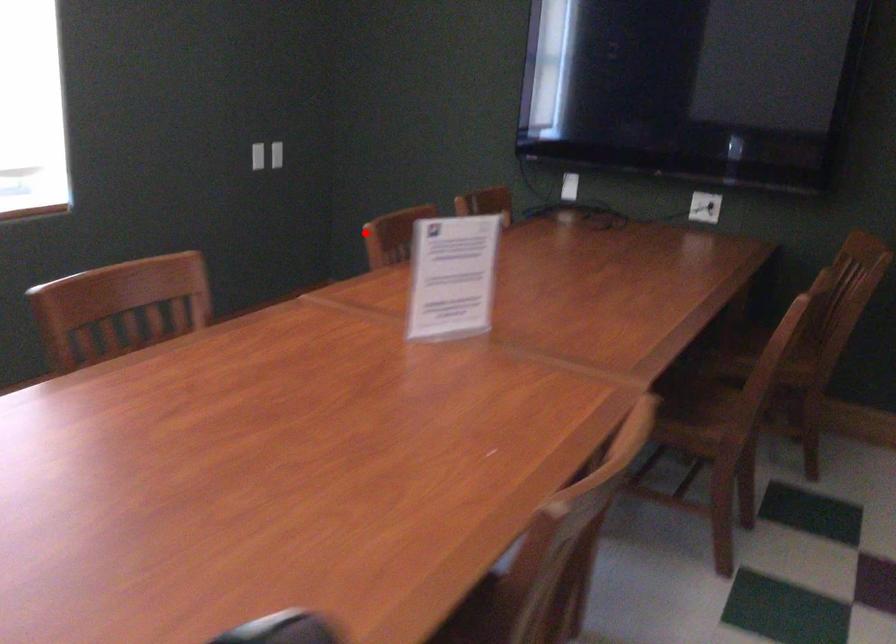
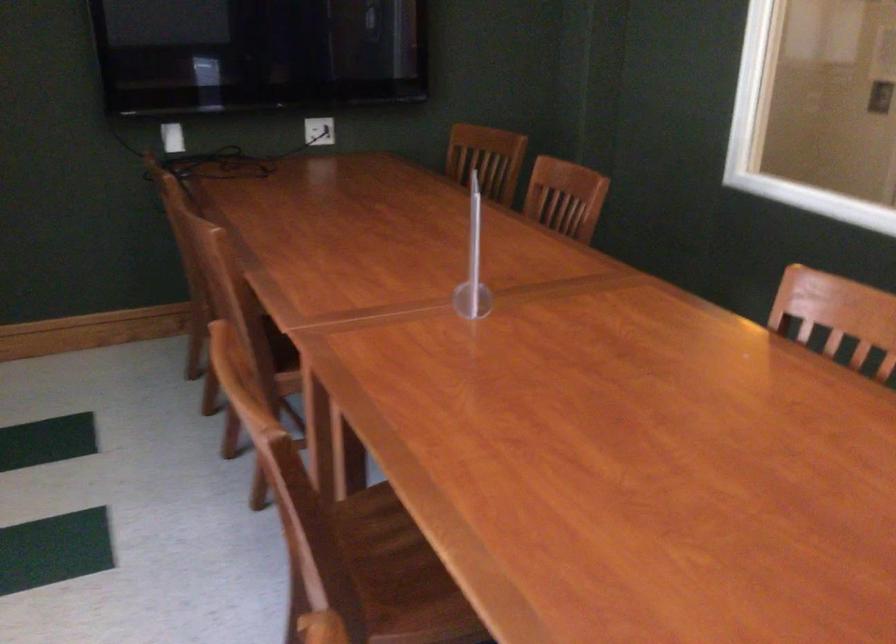
The point at the highlighted location is marked in the first image. Where is the corresponding point in the second image?

(216, 242)